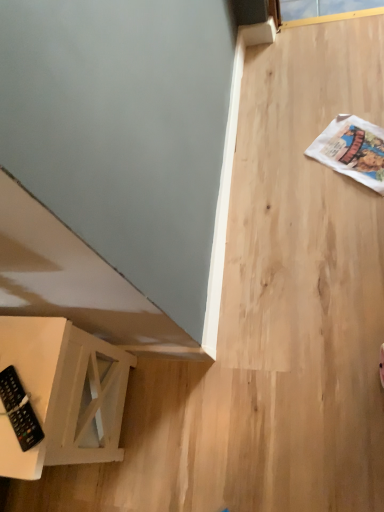
What do you see at coordinates (63, 394) in the screenshot? I see `white wood side table at lower left` at bounding box center [63, 394].

Locate an element on the screen. white wood side table at lower left is located at coordinates (63, 394).

This screenshot has height=512, width=384. What do you see at coordinates (19, 410) in the screenshot? I see `black plastic remote at lower left` at bounding box center [19, 410].

This screenshot has height=512, width=384. In order to click on black plastic remote at lower left in this screenshot , I will do `click(19, 410)`.

Where is `white wood side table at lower left`? white wood side table at lower left is located at coordinates (63, 394).

Considering the positions of objects black plastic remote at lower left and white wood side table at lower left in the image provided, who is more to the left, black plastic remote at lower left or white wood side table at lower left?

Positioned to the left is white wood side table at lower left.

Is black plastic remote at lower left in front of or behind white wood side table at lower left in the image?

Visually, black plastic remote at lower left is located behind white wood side table at lower left.

Does point (28, 404) appear closer or farther from the camera than point (50, 377)?

Point (28, 404) is positioned closer to the camera compared to point (50, 377).

From the image's perspective, which one is positioned higher, black plastic remote at lower left or white wood side table at lower left?

black plastic remote at lower left appears higher in the image.

In the scene shown: From a real-world perspective, which is physically below, black plastic remote at lower left or white wood side table at lower left?

white wood side table at lower left.

Which of these two, black plastic remote at lower left or white wood side table at lower left, is wider?

Wider between the two is white wood side table at lower left.

Who is taller, black plastic remote at lower left or white wood side table at lower left?

Standing taller between the two is white wood side table at lower left.

Considering the sizes of objects black plastic remote at lower left and white wood side table at lower left in the image provided, who is bigger, black plastic remote at lower left or white wood side table at lower left?

white wood side table at lower left is bigger.

Which is correct: black plastic remote at lower left is inside white wood side table at lower left, or outside of it?

black plastic remote at lower left lies outside white wood side table at lower left.

Is black plastic remote at lower left directly adjacent to white wood side table at lower left?

No.

Is black plastic remote at lower left positioned with its back to white wood side table at lower left?

black plastic remote at lower left is not turned away from white wood side table at lower left.

Can you tell me how much black plastic remote at lower left and white wood side table at lower left differ in facing direction?

The facing directions of black plastic remote at lower left and white wood side table at lower left are 49.8 degrees apart.

Consider the image. How much distance is there between black plastic remote at lower left and white wood side table at lower left?

black plastic remote at lower left is 7.22 inches from white wood side table at lower left.

Identify the location of control above the white wood side table at lower left (from the image's perspective). (19, 410).

Between white wood side table at lower left and black plastic remote at lower left, which one appears on the left side from the viewer's perspective?

white wood side table at lower left.

In the scene shown: Which is in front, white wood side table at lower left or black plastic remote at lower left?

white wood side table at lower left is closer to the camera.

Which is closer, (x=79, y=369) or (x=15, y=399)?

Clearly, point (x=79, y=369) is more distant from the camera than point (x=15, y=399).

From the image's perspective, is white wood side table at lower left positioned above or below black plastic remote at lower left?

white wood side table at lower left is situated lower than black plastic remote at lower left in the image.

From a real-world perspective, who is located higher, white wood side table at lower left or black plastic remote at lower left?

black plastic remote at lower left is physically above.

In terms of width, does white wood side table at lower left look wider or thinner when compared to black plastic remote at lower left?

Clearly, white wood side table at lower left has more width compared to black plastic remote at lower left.

Considering the relative sizes of white wood side table at lower left and black plastic remote at lower left in the image provided, is white wood side table at lower left taller than black plastic remote at lower left?

Indeed, white wood side table at lower left has a greater height compared to black plastic remote at lower left.

Considering the sizes of objects white wood side table at lower left and black plastic remote at lower left in the image provided, who is bigger, white wood side table at lower left or black plastic remote at lower left?

white wood side table at lower left.

Is white wood side table at lower left spatially inside black plastic remote at lower left, or outside of it?

white wood side table at lower left is outside black plastic remote at lower left.

Is white wood side table at lower left next to black plastic remote at lower left?

No, white wood side table at lower left is not in contact with black plastic remote at lower left.

Is black plastic remote at lower left at the back of white wood side table at lower left?

No, black plastic remote at lower left is not at the back of white wood side table at lower left.

What's the angular difference between white wood side table at lower left and black plastic remote at lower left's facing directions?

49.8 degrees.

At what (x,y) coordinates should I click in order to perform the action: click on control above the white wood side table at lower left (from a real-world perspective). Please return your answer as a coordinate pair (x, y). This screenshot has width=384, height=512. Looking at the image, I should click on pyautogui.click(x=19, y=410).

In the image, there is a black plastic remote at lower left. Where is `furniture below it (from the image's perspective)`? This screenshot has width=384, height=512. furniture below it (from the image's perspective) is located at coordinates click(x=63, y=394).

This screenshot has height=512, width=384. I want to click on furniture in front of the black plastic remote at lower left, so click(x=63, y=394).